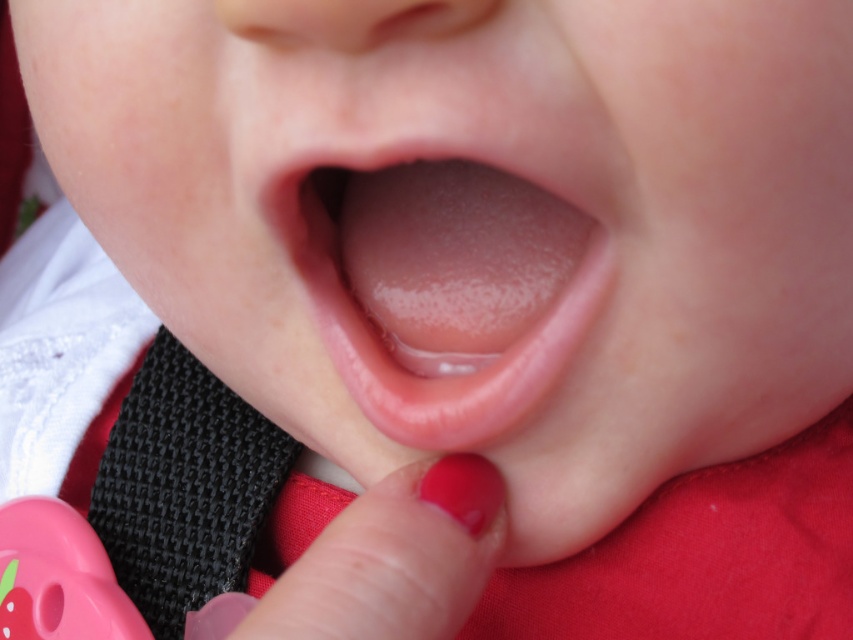
You are a caregiver trying to comfort a baby in a car seat. You notice the smooth pink tongue at center and the black woven strap at lower left. Which object is nearer to you?

The smooth pink tongue at center is closer to the viewer than the black woven strap at lower left, so the smooth pink tongue at center is nearer to you.

Looking at this image, you are a pediatrician examining a baby who seems uncomfortable. You notice the smooth pink tongue at center and the glossy plastic teething ring at lower center. Which object is larger in size?

The smooth pink tongue at center is bigger than the glossy plastic teething ring at lower center, so the smooth pink tongue at center is larger in size.